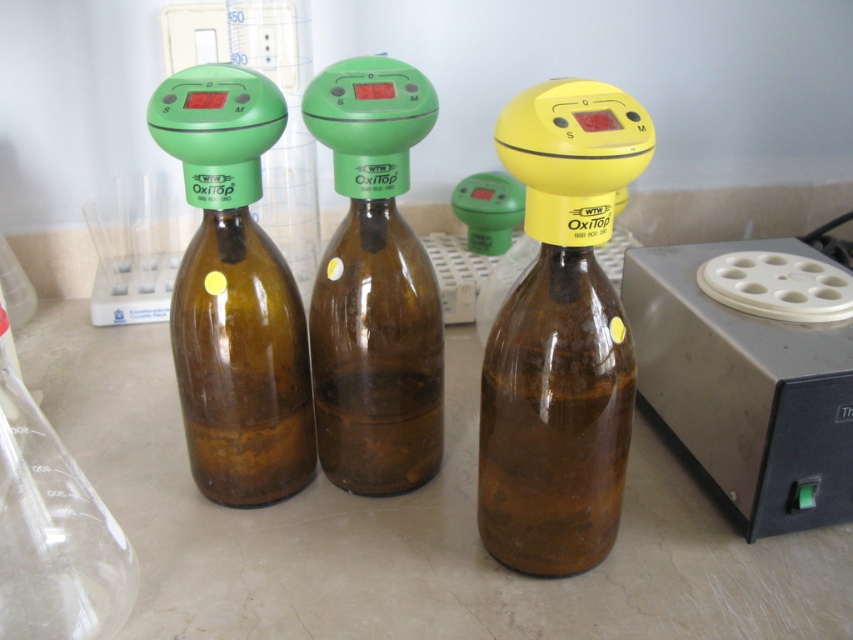
You are a lab technician who needs to place a new test tube rack in the lab. The ideal spot is between the three brown glass bottles and the gray plastic centrifuge at right. Based on their positions, can you confirm if there is enough space between them for the rack?

The gray plastic centrifuge at right is located at point (750, 371). Since the three brown glass bottles are placed side by side on the countertop and the centrifuge is to the right of them, there is likely sufficient space between the bottles and the centrifuge to place the test tube rack.

You are a lab technician who needs to adjust the oxygen meter on the yellow matte bottle at center and the green matte bottle at center. Since you can only reach the leftmost bottle first, which bottle should you start with?

You should start with the green matte bottle at center because it is positioned to the left of the yellow matte bottle at center, making it the leftmost bottle.